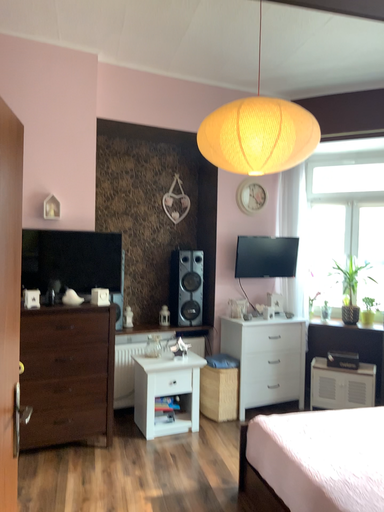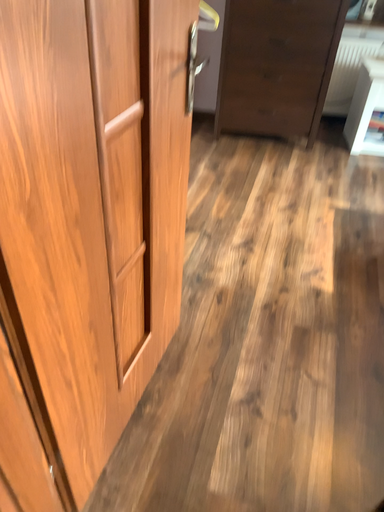
Question: How did the camera likely rotate when shooting the video?

Choices:
 (A) rotated downward
 (B) rotated upward

Answer: (A)